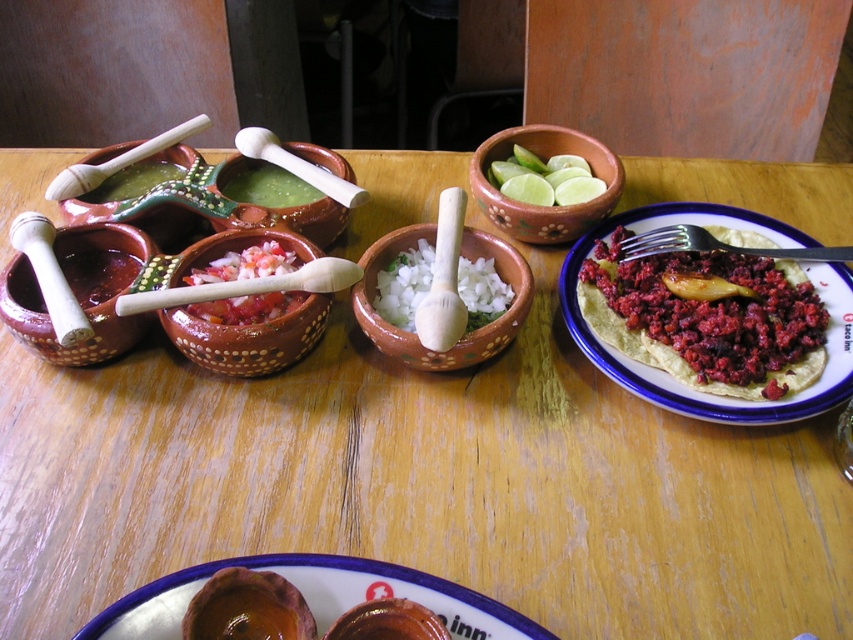
Does matte clay bowl at center have a greater height compared to chopped tomato salsa at center?

Yes, matte clay bowl at center is taller than chopped tomato salsa at center.

Is matte clay bowl at center positioned in front of chopped tomato salsa at center?

No, it is behind chopped tomato salsa at center.

What do you see at coordinates (276, 205) in the screenshot? I see `matte clay bowl at center` at bounding box center [276, 205].

You are a GUI agent. You are given a task and a screenshot of the screen. Output one action in this format:
    pyautogui.click(x=<x>, y=<y>)
    Task: Click on the matte clay bowl at center
    The image size is (853, 640).
    Given the screenshot: What is the action you would take?
    pyautogui.click(x=276, y=205)

Measure the distance between matte clay bowl at center and camera.

A distance of 30.79 inches exists between matte clay bowl at center and camera.

You are a GUI agent. You are given a task and a screenshot of the screen. Output one action in this format:
    pyautogui.click(x=<x>, y=<y>)
    Task: Click on the matte clay bowl at center
    
    Given the screenshot: What is the action you would take?
    pyautogui.click(x=276, y=205)

Where is `matte clay bowl at center`? The image size is (853, 640). matte clay bowl at center is located at coordinates (276, 205).

How much distance is there between white ceramic bowl at center and white wood pestle at center?

white ceramic bowl at center and white wood pestle at center are 5.95 inches apart from each other.

The width and height of the screenshot is (853, 640). What do you see at coordinates (463, 336) in the screenshot?
I see `white ceramic bowl at center` at bounding box center [463, 336].

Where is `white ceramic bowl at center`? white ceramic bowl at center is located at coordinates (463, 336).